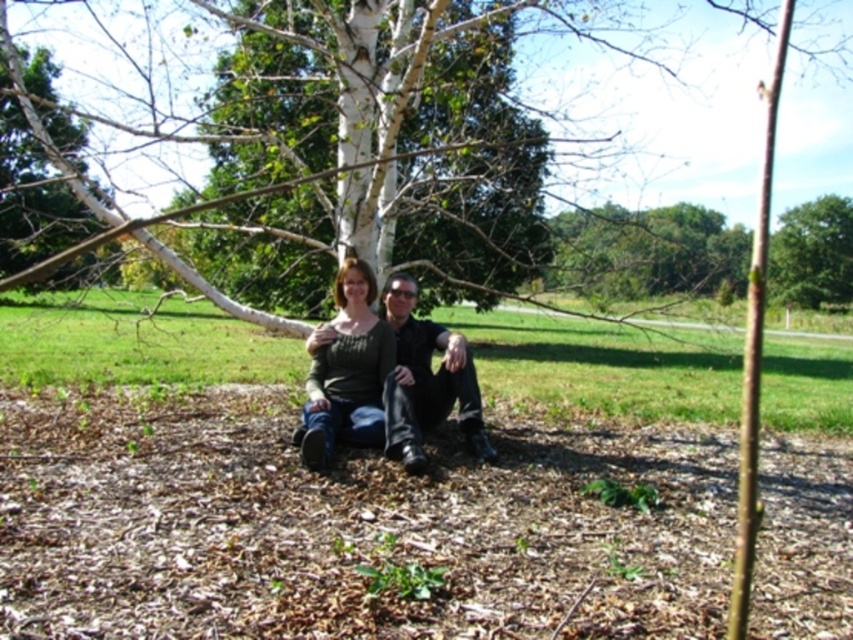
Is matte green sweater at center positioned before black leather jacket at center?

No.

Where is `matte green sweater at center`? This screenshot has height=640, width=853. matte green sweater at center is located at coordinates (347, 371).

You are a GUI agent. You are given a task and a screenshot of the screen. Output one action in this format:
    pyautogui.click(x=<x>, y=<y>)
    Task: Click on the matte green sweater at center
    The width and height of the screenshot is (853, 640).
    Given the screenshot: What is the action you would take?
    pyautogui.click(x=347, y=371)